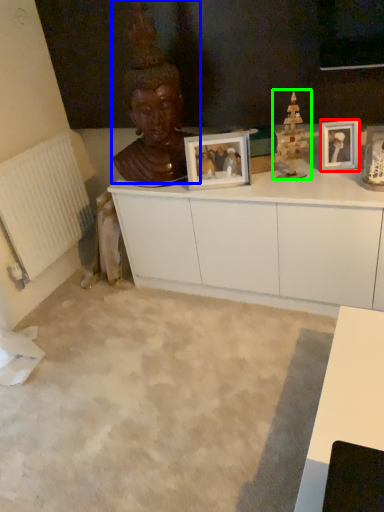
Question: Which object is the closest to the picture frame (highlighted by a red box)? Choose among these: person (highlighted by a blue box) or toy (highlighted by a green box).

Choices:
 (A) person
 (B) toy

Answer: (B)